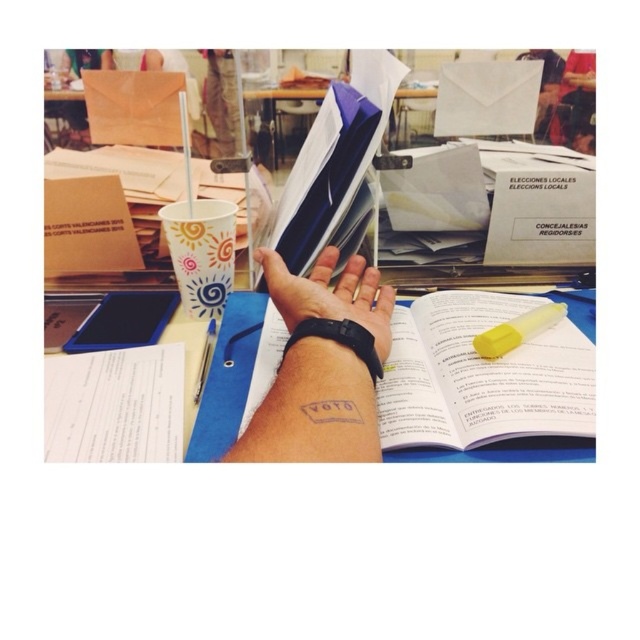
Between blue glossy folder at center and yellow translucent pen at center, which one appears on the right side from the viewer's perspective?

blue glossy folder at center is more to the right.

Who is more distant from viewer, (285, 195) or (198, 365)?

Point (285, 195)

Who is more distant from viewer, (x=353, y=145) or (x=209, y=321)?

Positioned behind is point (x=209, y=321).

Where is `blue glossy folder at center`? blue glossy folder at center is located at coordinates (323, 173).

Does black rubber wristband at center lie behind yellow translucent pen at center?

No, black rubber wristband at center is in front of yellow translucent pen at center.

Is point (356, 358) in front of point (198, 360)?

That is True.

Is point (333, 460) positioned behind point (202, 358)?

No, it is not.

Where is `black rubber wristband at center`? This screenshot has height=640, width=640. black rubber wristband at center is located at coordinates (321, 368).

Can you confirm if black rubber wristband at center is smaller than multicolored paper cup at center?

No, black rubber wristband at center is not smaller than multicolored paper cup at center.

Between black rubber wristband at center and multicolored paper cup at center, which one has more height?

Standing taller between the two is black rubber wristband at center.

What do you see at coordinates (321, 368) in the screenshot?
I see `black rubber wristband at center` at bounding box center [321, 368].

Where is `black rubber wristband at center`? black rubber wristband at center is located at coordinates (321, 368).